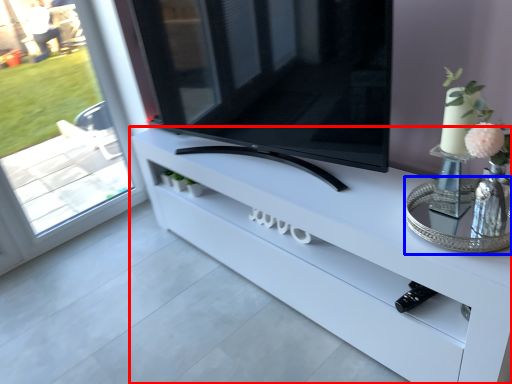
Question: Among these objects, which one is farthest to the camera, furniture (highlighted by a red box) or glass table (highlighted by a blue box)?

Choices:
 (A) furniture
 (B) glass table

Answer: (B)